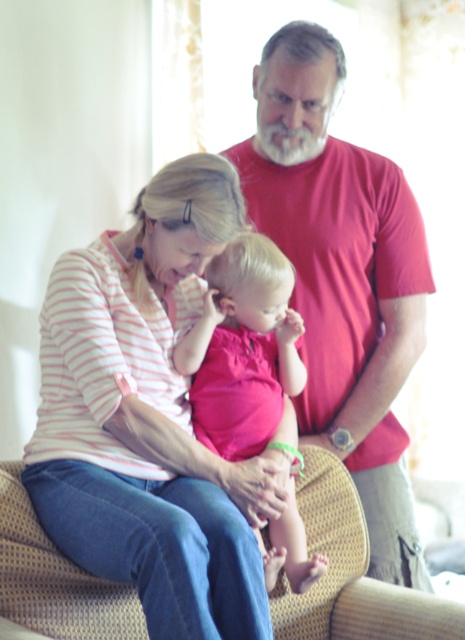
Question: Considering the real-world distances, which object is closest to the pink striped shirt at center?

Choices:
 (A) smooth red shirt at center
 (B) pink fabric baby at center

Answer: (B)

Question: Is smooth red shirt at center to the right of pink fabric baby at center from the viewer's perspective?

Choices:
 (A) no
 (B) yes

Answer: (B)

Question: Which point appears farthest from the camera in this image?

Choices:
 (A) (167, 609)
 (B) (318, 404)
 (C) (219, 275)

Answer: (B)

Question: Is pink striped shirt at center wider than pink fabric baby at center?

Choices:
 (A) yes
 (B) no

Answer: (A)

Question: Does smooth red shirt at center have a lesser width compared to pink fabric baby at center?

Choices:
 (A) yes
 (B) no

Answer: (B)

Question: Which object is positioned closest to the pink fabric baby at center?

Choices:
 (A) smooth red shirt at center
 (B) pink striped shirt at center

Answer: (B)